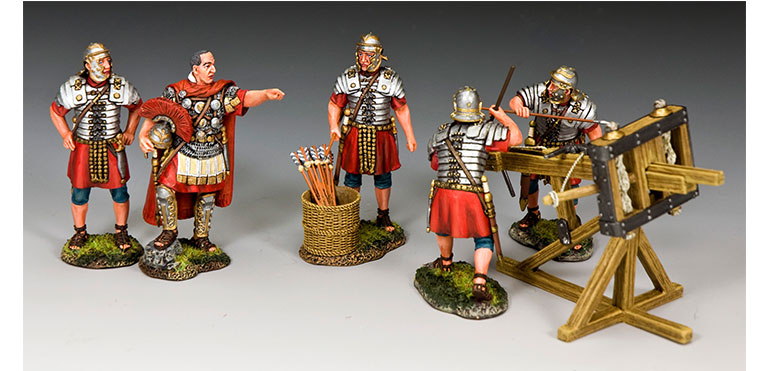
What are the coordinates of `figurines` in the screenshot? It's located at (467, 200).